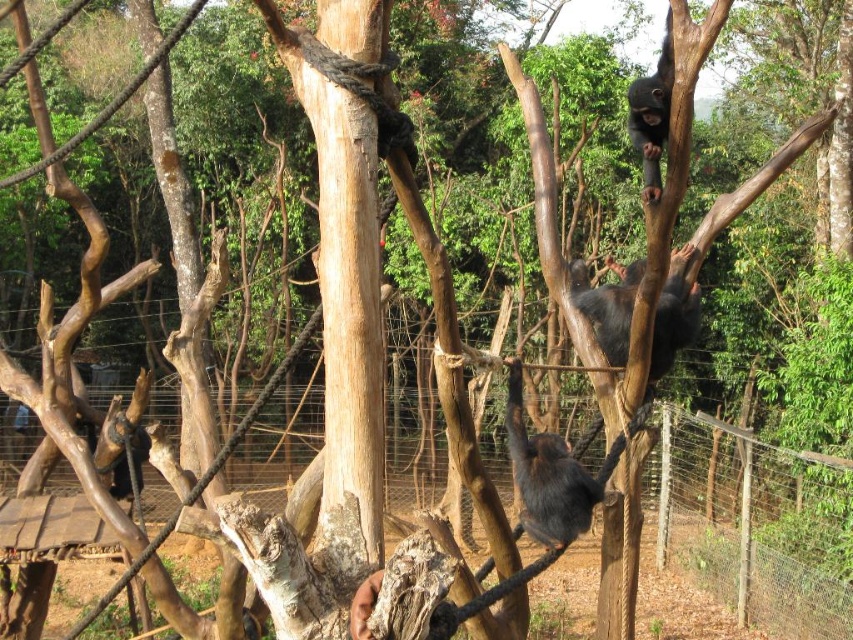
Question: Does wire mesh fence at center appear on the left side of shiny black monkey at upper right?

Choices:
 (A) no
 (B) yes

Answer: (B)

Question: Is wire mesh fence at center below shiny black monkey at upper right?

Choices:
 (A) yes
 (B) no

Answer: (A)

Question: Which of the following is the closest to the observer?

Choices:
 (A) wire mesh fence at center
 (B) shiny black monkey at upper right
 (C) black fur monkey at upper center
 (D) shiny black monkey at center

Answer: (A)

Question: Is wire mesh fence at center smaller than shiny black monkey at center?

Choices:
 (A) yes
 (B) no

Answer: (A)

Question: Which object is farther from the camera taking this photo?

Choices:
 (A) wire mesh fence at center
 (B) shiny black monkey at upper right

Answer: (B)

Question: Which of the following is the farthest from the observer?

Choices:
 (A) black fur monkey at upper center
 (B) shiny black monkey at center
 (C) wire mesh fence at center

Answer: (A)